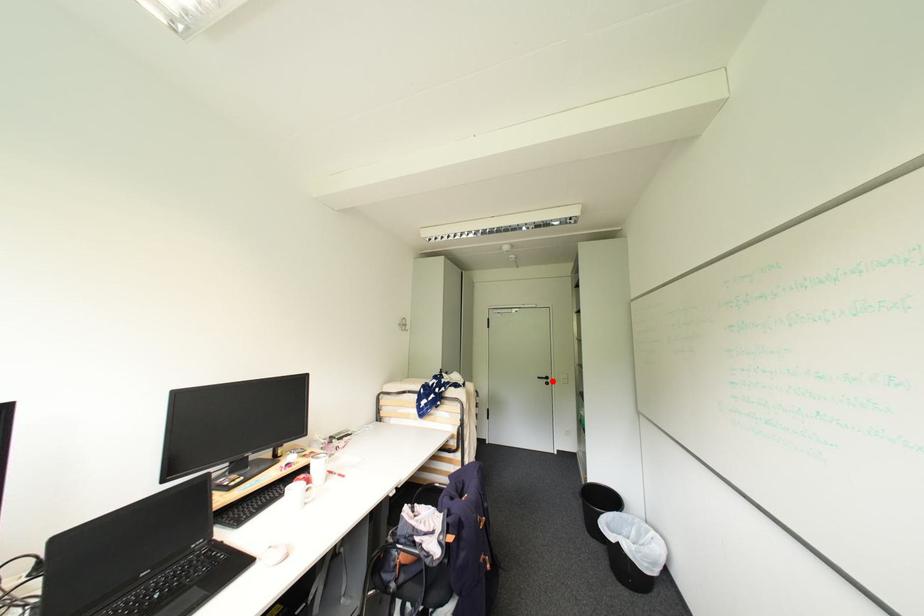
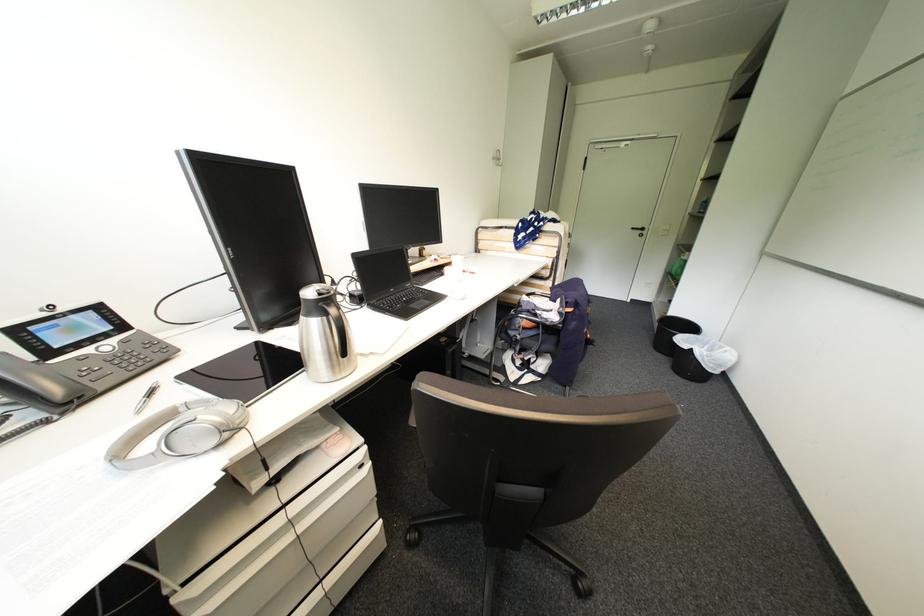
Locate, in the second image, the point that corresponds to the highlighted location in the first image.

(648, 233)